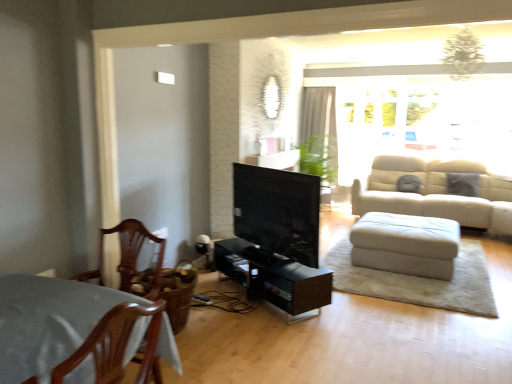
Question: From a real-world perspective, is black glossy entertainment center at center on top of mahogany wood chair at left?

Choices:
 (A) no
 (B) yes

Answer: (A)

Question: Is black glossy entertainment center at center facing away from mahogany wood chair at left?

Choices:
 (A) no
 (B) yes

Answer: (A)

Question: Considering the relative sizes of black glossy entertainment center at center and mahogany wood chair at left in the image provided, is black glossy entertainment center at center wider than mahogany wood chair at left?

Choices:
 (A) yes
 (B) no

Answer: (A)

Question: Is mahogany wood chair at left completely or partially inside black glossy entertainment center at center?

Choices:
 (A) yes
 (B) no

Answer: (B)

Question: Is black glossy entertainment center at center oriented towards mahogany wood chair at left?

Choices:
 (A) yes
 (B) no

Answer: (B)

Question: From a real-world perspective, is black glossy entertainment center at center positioned under mahogany wood chair at left based on gravity?

Choices:
 (A) yes
 (B) no

Answer: (A)

Question: Is there a large distance between translucent glass window at upper right and white sheer curtain at upper center?

Choices:
 (A) yes
 (B) no

Answer: (B)

Question: From a real-world perspective, is translucent glass window at upper right over white sheer curtain at upper center?

Choices:
 (A) no
 (B) yes

Answer: (B)

Question: From a real-world perspective, is translucent glass window at upper right below white sheer curtain at upper center?

Choices:
 (A) no
 (B) yes

Answer: (A)

Question: From the image's perspective, is translucent glass window at upper right on top of white sheer curtain at upper center?

Choices:
 (A) yes
 (B) no

Answer: (A)

Question: Is translucent glass window at upper right outside white sheer curtain at upper center?

Choices:
 (A) yes
 (B) no

Answer: (A)

Question: Is translucent glass window at upper right at the right side of white sheer curtain at upper center?

Choices:
 (A) no
 (B) yes

Answer: (B)

Question: Is white sheer curtain at upper center at the right side of white leather footrest at lower right?

Choices:
 (A) no
 (B) yes

Answer: (A)